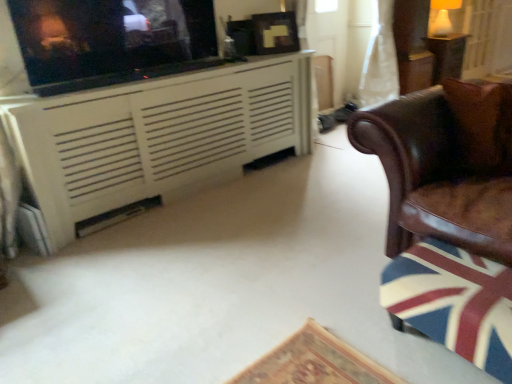
At what (x,y) coordinates should I click in order to perform the action: click on free space to the left of wooden swivel chair at right. Please return your answer as a coordinate pair (x, y). Image resolution: width=512 pixels, height=384 pixels. Looking at the image, I should click on (347, 339).